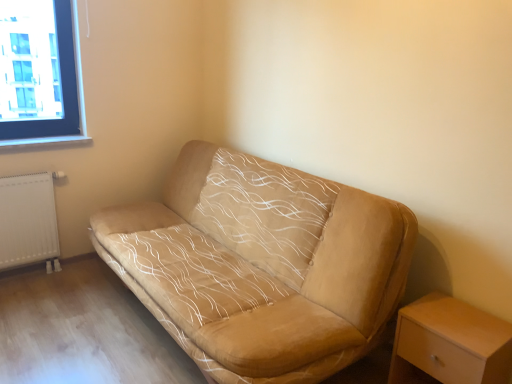
The width and height of the screenshot is (512, 384). In order to click on free space in front of white matte radiator at lower left in this screenshot , I will do `click(30, 293)`.